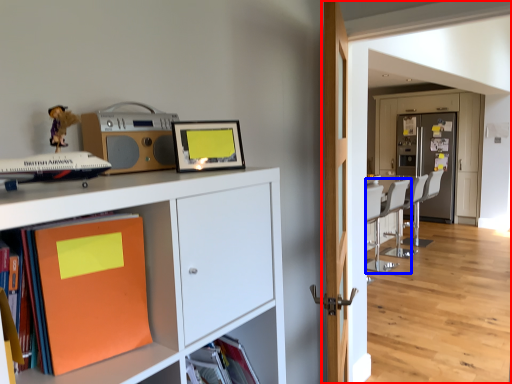
Question: Which object is further to the camera taking this photo, corridor (highlighted by a red box) or chair (highlighted by a blue box)?

Choices:
 (A) corridor
 (B) chair

Answer: (B)